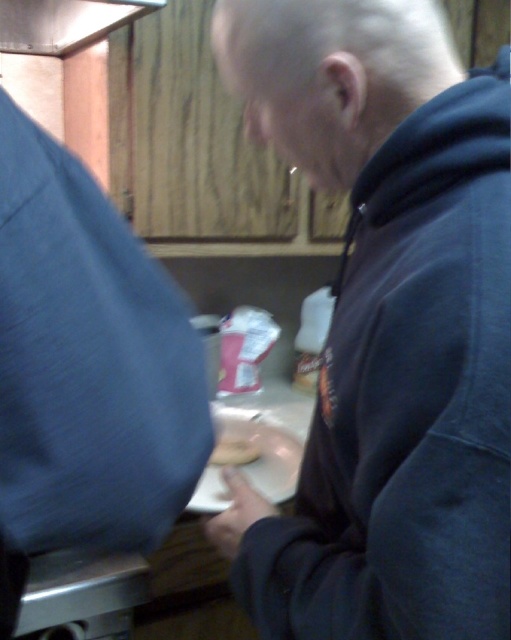
You are a delivery robot with a 20 inch wide package. You need to navigate between the dark blue hoodie at center and the metallic silver exhaust hood at upper left. Can you fit through the space between them?

The dark blue hoodie at center and metallic silver exhaust hood at upper left are 30.80 inches apart from each other. Since the package is 20 inches wide, there is enough space to fit through the gap between them.

You are standing in a kitchen and see the dark blue hoodie at center and the metallic silver exhaust hood at upper left. Which object is closer to you?

The dark blue hoodie at center is closer to you because it is in front of the metallic silver exhaust hood at upper left.